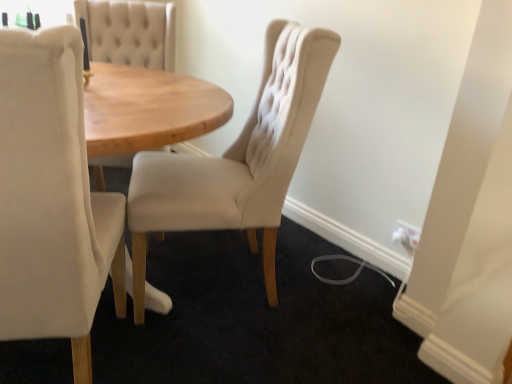
Question: Could you tell me if beige fabric chair at center, which is the 1th chair in right-to-left order, is turned towards white plastic electric outlet at lower right?

Choices:
 (A) yes
 (B) no

Answer: (B)

Question: From the image's perspective, is beige fabric chair at center, which is the 1th chair in right-to-left order, under white plastic electric outlet at lower right?

Choices:
 (A) yes
 (B) no

Answer: (B)

Question: From a real-world perspective, does beige fabric chair at center, which is the 1th chair in right-to-left order, stand above white plastic electric outlet at lower right?

Choices:
 (A) no
 (B) yes

Answer: (B)

Question: Are beige fabric chair at center, which is the second chair from left to right, and white plastic electric outlet at lower right located far from each other?

Choices:
 (A) yes
 (B) no

Answer: (B)

Question: Is beige fabric chair at center, which is the 1th chair in right-to-left order, to the right of white plastic electric outlet at lower right from the viewer's perspective?

Choices:
 (A) yes
 (B) no

Answer: (B)

Question: Considering the relative sizes of beige fabric chair at center, which is the second chair from left to right, and white plastic electric outlet at lower right in the image provided, is beige fabric chair at center, which is the second chair from left to right, smaller than white plastic electric outlet at lower right?

Choices:
 (A) no
 (B) yes

Answer: (A)

Question: Is beige fabric chair at left, placed as the second chair when sorted from right to left, to the left of beige fabric chair at center, which is the second chair from left to right, from the viewer's perspective?

Choices:
 (A) yes
 (B) no

Answer: (A)

Question: Considering the relative sizes of beige fabric chair at left, placed as the second chair when sorted from right to left, and beige fabric chair at center, which is the 1th chair in right-to-left order, in the image provided, is beige fabric chair at left, placed as the second chair when sorted from right to left, thinner than beige fabric chair at center, which is the 1th chair in right-to-left order,?

Choices:
 (A) yes
 (B) no

Answer: (B)

Question: Would you say beige fabric chair at left, placed as the second chair when sorted from right to left, contains beige fabric chair at center, which is the second chair from left to right?

Choices:
 (A) no
 (B) yes

Answer: (A)

Question: Is beige fabric chair at left, which is the 1th chair in left-to-right order, not near beige fabric chair at center, which is the 1th chair in right-to-left order?

Choices:
 (A) yes
 (B) no

Answer: (B)

Question: From a real-world perspective, is beige fabric chair at left, placed as the second chair when sorted from right to left, positioned over beige fabric chair at center, which is the 1th chair in right-to-left order, based on gravity?

Choices:
 (A) no
 (B) yes

Answer: (B)

Question: Is beige fabric chair at left, placed as the second chair when sorted from right to left, outside beige fabric chair at center, which is the 1th chair in right-to-left order?

Choices:
 (A) no
 (B) yes

Answer: (B)

Question: From the image's perspective, does beige fabric chair at left, placed as the second chair when sorted from right to left, appear higher than white plastic electric outlet at lower right?

Choices:
 (A) yes
 (B) no

Answer: (A)